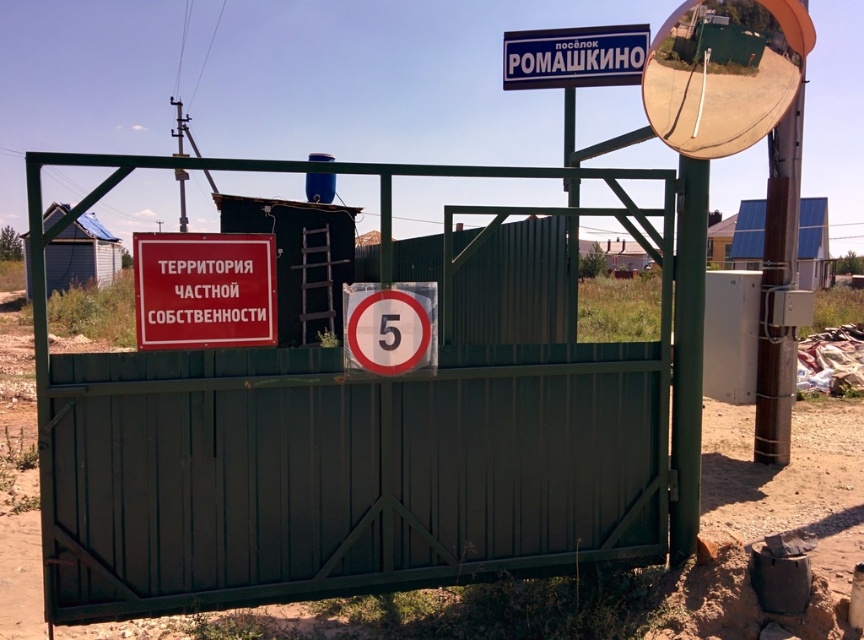
Is green painted metal gate at center to the right of red matte sign at center from the viewer's perspective?

Yes, green painted metal gate at center is to the right of red matte sign at center.

Which is below, green painted metal gate at center or red matte sign at center?

red matte sign at center is below.

Between point (41, 433) and point (157, 344), which one is positioned behind?

Positioned behind is point (157, 344).

Locate an element on the screen. This screenshot has height=640, width=864. green painted metal gate at center is located at coordinates (342, 445).

Is green painted metal gate at center taller than blue plastic signboard at upper center?

In fact, green painted metal gate at center may be shorter than blue plastic signboard at upper center.

Does green painted metal gate at center appear over blue plastic signboard at upper center?

No, green painted metal gate at center is not above blue plastic signboard at upper center.

Does point (61, 595) lie behind point (566, 51)?

That is False.

Identify the location of green painted metal gate at center. This screenshot has height=640, width=864. (342, 445).

Does red matte sign at center lie in front of blue plastic signboard at upper center?

Yes, it is.

Is point (154, 294) farther from viewer compared to point (507, 72)?

No, (154, 294) is closer to viewer.

Which is in front, point (251, 236) or point (541, 76)?

Positioned in front is point (251, 236).

This screenshot has height=640, width=864. Identify the location of red matte sign at center. (202, 289).